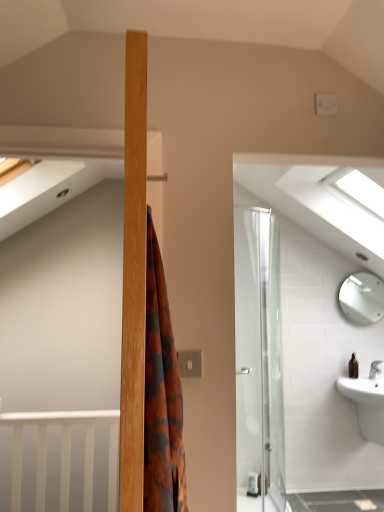
Question: Is brown glass bottle at lower right positioned in front of white glossy sink at lower right?

Choices:
 (A) no
 (B) yes

Answer: (A)

Question: Considering the relative sizes of brown glass bottle at lower right and white glossy sink at lower right in the image provided, is brown glass bottle at lower right smaller than white glossy sink at lower right?

Choices:
 (A) yes
 (B) no

Answer: (A)

Question: Is brown glass bottle at lower right bigger than white glossy sink at lower right?

Choices:
 (A) no
 (B) yes

Answer: (A)

Question: From the image's perspective, is brown glass bottle at lower right below white glossy sink at lower right?

Choices:
 (A) yes
 (B) no

Answer: (B)

Question: Is brown glass bottle at lower right thinner than white glossy sink at lower right?

Choices:
 (A) no
 (B) yes

Answer: (B)

Question: Is brown glass bottle at lower right to the right of white glossy sink at lower right from the viewer's perspective?

Choices:
 (A) no
 (B) yes

Answer: (A)

Question: Is brown glass bottle at lower right wider than transparent glass window at upper right?

Choices:
 (A) yes
 (B) no

Answer: (B)

Question: Can you confirm if brown glass bottle at lower right is shorter than transparent glass window at upper right?

Choices:
 (A) no
 (B) yes

Answer: (B)

Question: Would you say brown glass bottle at lower right is a long distance from transparent glass window at upper right?

Choices:
 (A) no
 (B) yes

Answer: (B)

Question: Does brown glass bottle at lower right have a greater height compared to transparent glass window at upper right?

Choices:
 (A) yes
 (B) no

Answer: (B)

Question: From a real-world perspective, is brown glass bottle at lower right beneath transparent glass window at upper right?

Choices:
 (A) no
 (B) yes

Answer: (B)

Question: Is brown glass bottle at lower right closer to the viewer compared to transparent glass window at upper right?

Choices:
 (A) yes
 (B) no

Answer: (B)

Question: Can you confirm if transparent glass window at upper right is wider than white glossy sink at lower right?

Choices:
 (A) no
 (B) yes

Answer: (A)